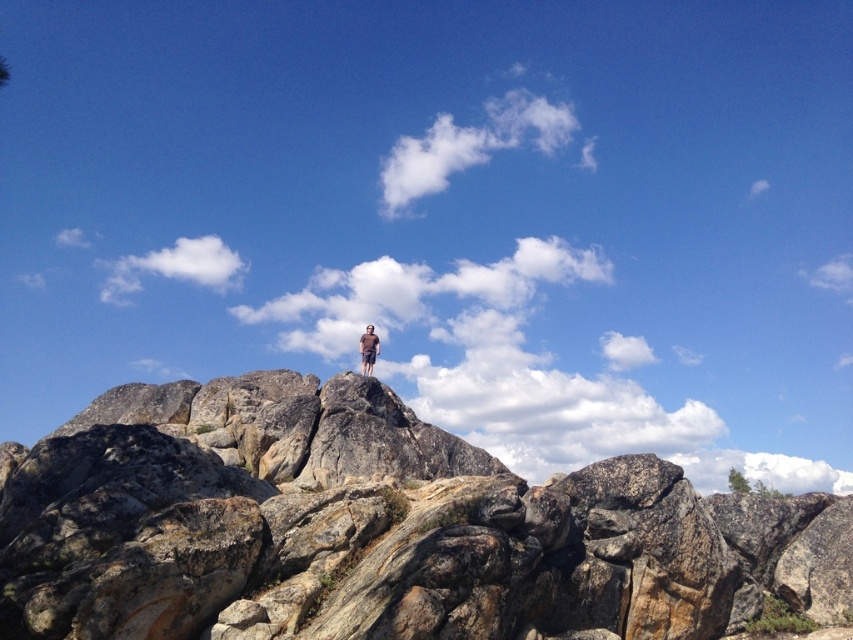
You are planning to place a small camping tent on the rough granite boulder at center. Considering the size of the brown cotton shirt at center, will the boulder provide enough space for the tent?

The rough granite boulder at center has a larger size compared to the brown cotton shirt at center. Since the boulder is bigger, it should provide sufficient space for a small camping tent.

In the scene shown: You are a hiker trying to locate your friend who is wearing a brown cotton shirt at center. You see a rough granite boulder at center in the distance. Which object is more to the right?

The rough granite boulder at center is positioned on the right side of brown cotton shirt at center, so the rough granite boulder at center is more to the right.

You are a hiker who wants to place a small flag on the rough granite boulder at center. However, you notice the brown cotton shirt at center is in the way. Can you reach the boulder without moving the shirt?

The rough granite boulder at center is closer to the viewer than the brown cotton shirt at center, so you can reach the boulder without moving the shirt because it is in front of the shirt.